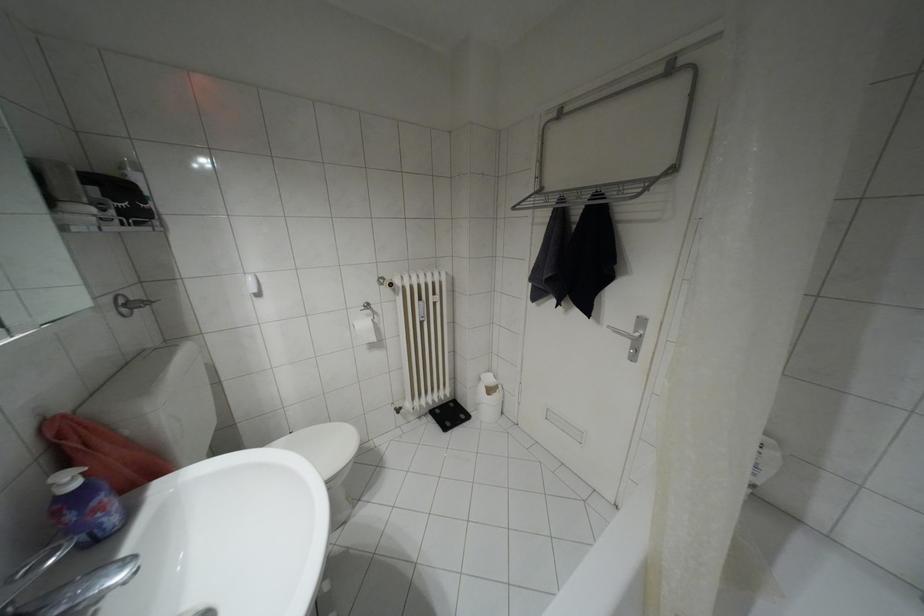
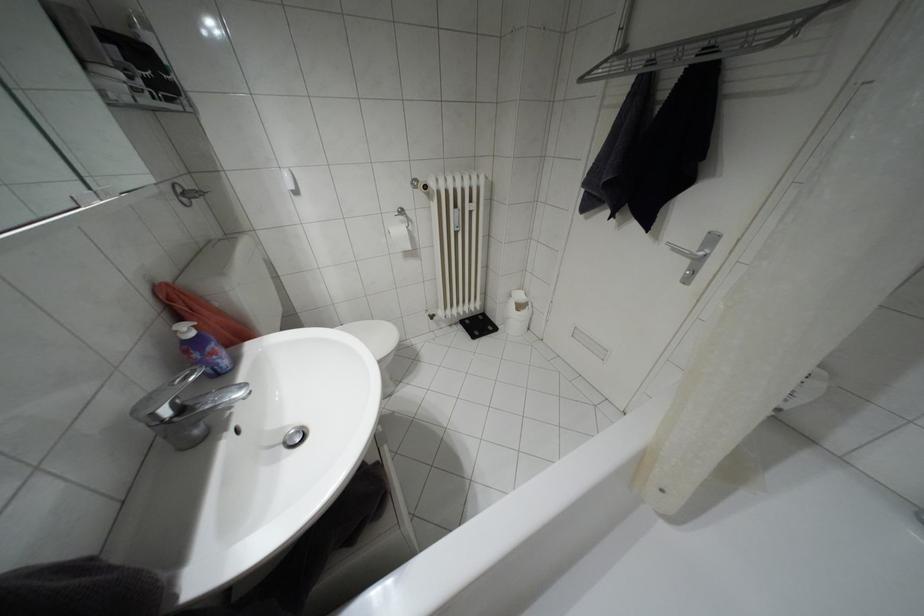
Find the pixel in the second image that matches point (75, 484) in the first image.

(190, 333)